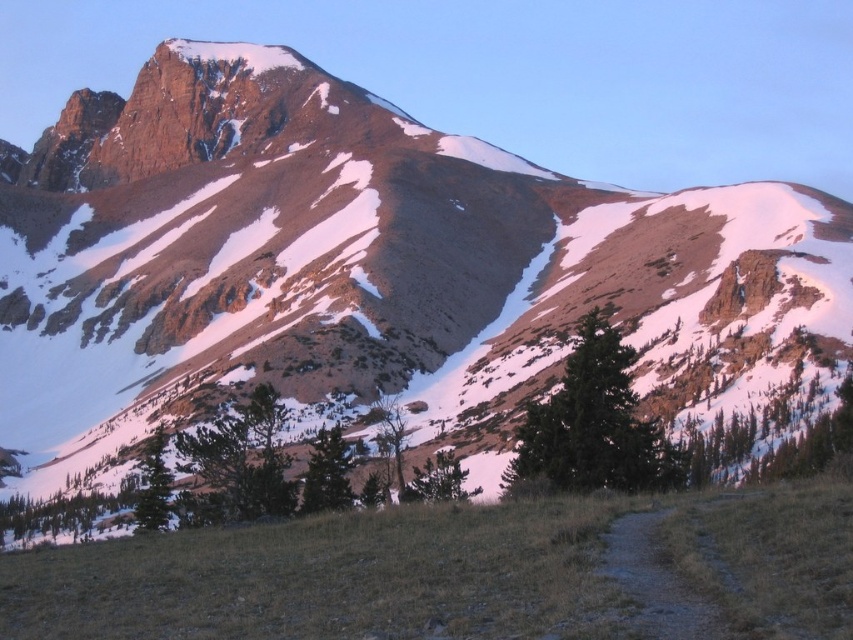
Question: Can you confirm if brown dirt path at center is positioned to the right of green matte tree at lower left?

Choices:
 (A) no
 (B) yes

Answer: (B)

Question: Which of the following is the closest to the observer?

Choices:
 (A) (323, 499)
 (B) (416, 474)
 (C) (149, 513)

Answer: (A)

Question: Which of the following is the closest to the observer?

Choices:
 (A) green textured tree at center
 (B) green matte tree at center

Answer: (A)

Question: Observing the image, what is the correct spatial positioning of green textured tree at center in reference to green matte tree at lower left?

Choices:
 (A) left
 (B) right

Answer: (B)

Question: Which object appears closest to the camera in this image?

Choices:
 (A) green textured tree at center
 (B) brown dirt path at center

Answer: (B)

Question: Does brown dirt path at center have a larger size compared to green matte tree at center?

Choices:
 (A) yes
 (B) no

Answer: (B)